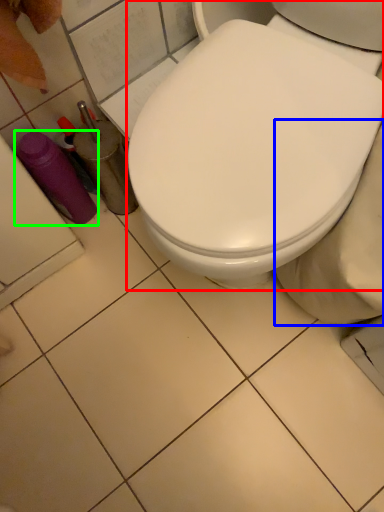
Question: Which object is the farthest from toilet (highlighted by a red box)? Choose among these: bidet (highlighted by a blue box) or bottle (highlighted by a green box).

Choices:
 (A) bidet
 (B) bottle

Answer: (B)